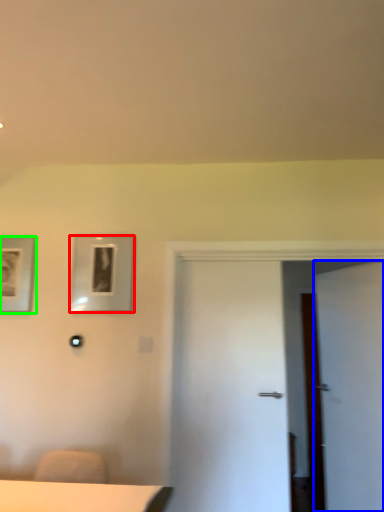
Question: Which object is the closest to the picture frame (highlighted by a red box)? Choose among these: door (highlighted by a blue box) or picture frame (highlighted by a green box).

Choices:
 (A) door
 (B) picture frame

Answer: (B)